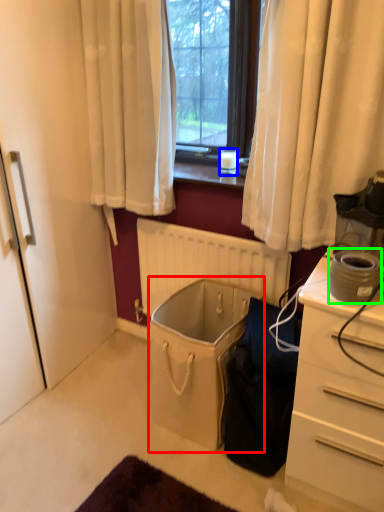
Question: Based on their relative distances, which object is nearer to laundry basket (highlighted by a red box)? Choose from coffee cup (highlighted by a blue box) and appliance (highlighted by a green box).

Choices:
 (A) coffee cup
 (B) appliance

Answer: (B)